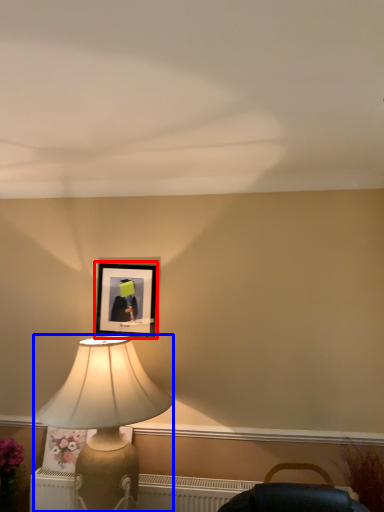
Question: Which of the following is the farthest to the observer, picture frame (highlighted by a red box) or lamp (highlighted by a blue box)?

Choices:
 (A) picture frame
 (B) lamp

Answer: (A)